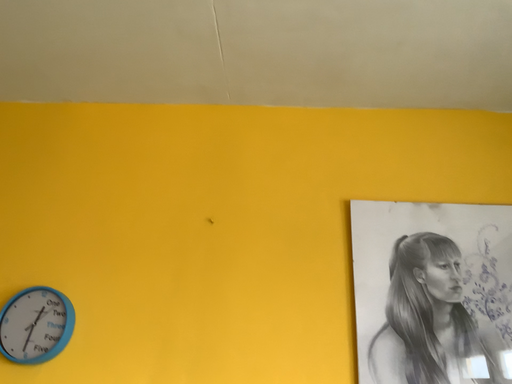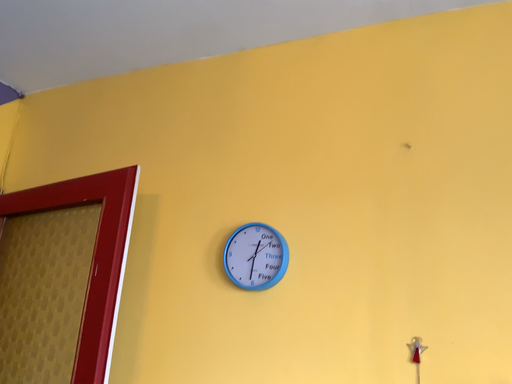
Question: How did the camera likely rotate when shooting the video?

Choices:
 (A) rotated right
 (B) rotated left

Answer: (B)